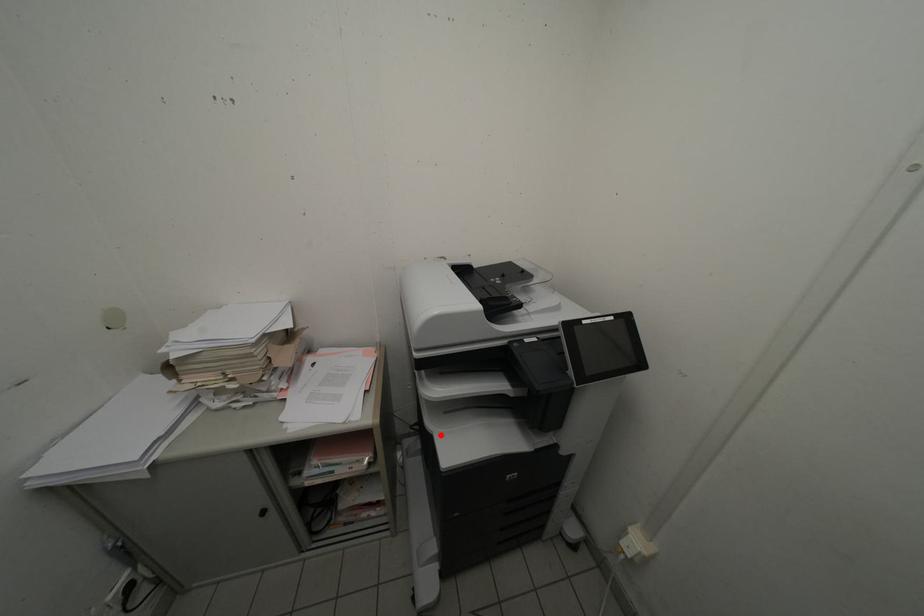
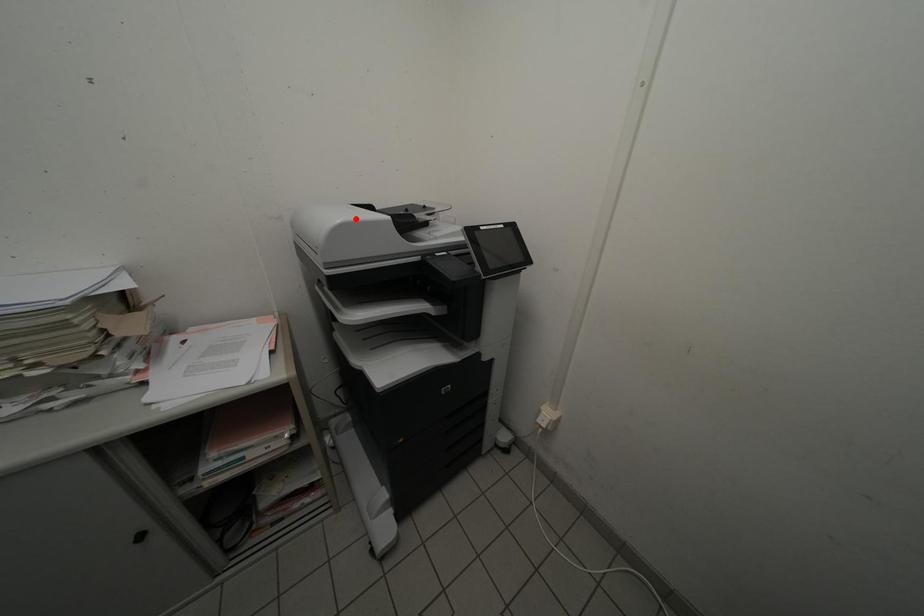
I am providing you with two images of the same scene from different viewpoints. A red point is marked on the first image and another point is marked on the second image. Does the point marked in image1 correspond to the same location as the one in image2?

No